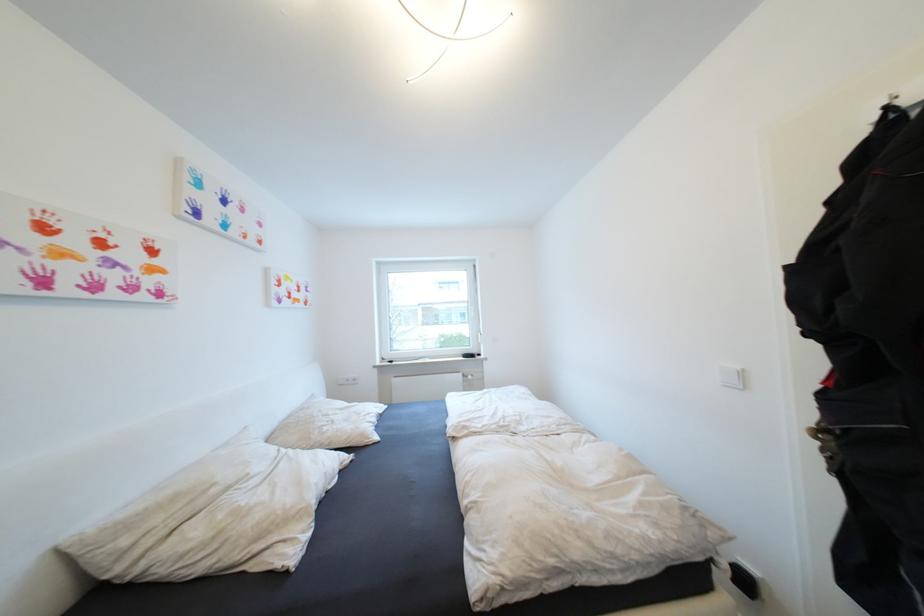
What do you see at coordinates (475, 326) in the screenshot?
I see `the window handle` at bounding box center [475, 326].